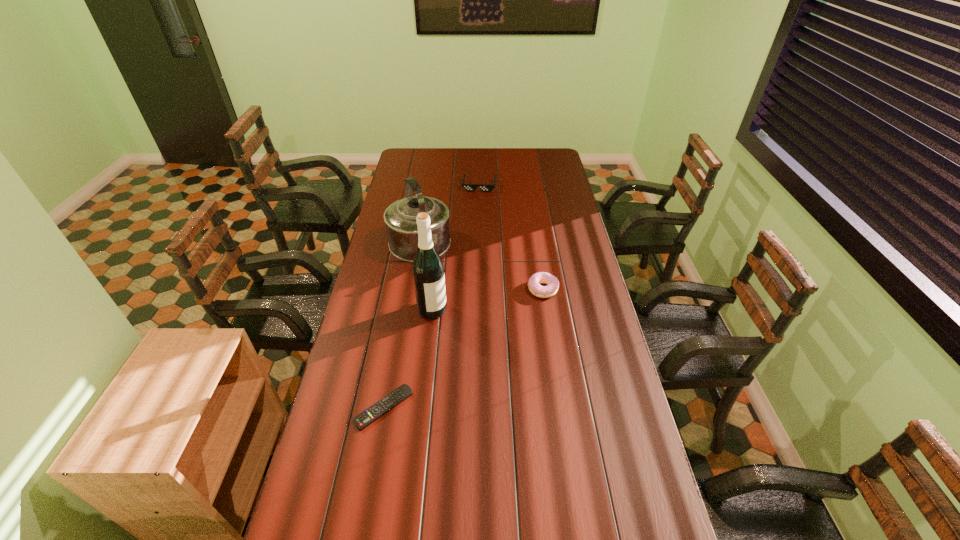
Identify the location of remote control. (387, 403).

Where is `the shortest object`? The width and height of the screenshot is (960, 540). the shortest object is located at coordinates (387, 403).

At what (x,y) coordinates should I click in order to perform the action: click on the rightmost object. Please return your answer as a coordinate pair (x, y). Image resolution: width=960 pixels, height=540 pixels. Looking at the image, I should click on (535, 280).

Locate an element on the screen. the second object from right to left is located at coordinates (469, 187).

Where is `the farthest object`? the farthest object is located at coordinates (469, 187).

Where is `the second farthest object`? Image resolution: width=960 pixels, height=540 pixels. the second farthest object is located at coordinates (400, 217).

Where is `kettle`? Image resolution: width=960 pixels, height=540 pixels. kettle is located at coordinates (400, 217).

Where is `wine bottle`? This screenshot has width=960, height=540. wine bottle is located at coordinates (428, 271).

Locate an element on the screen. Image resolution: width=960 pixels, height=540 pixels. vacant space located on the right of the shortest object is located at coordinates (468, 407).

You are a GUI agent. You are given a task and a screenshot of the screen. Output one action in this format:
    pyautogui.click(x=<x>, y=<y>)
    Task: Click on the vacant space located on the front of the rightmost object
    The image size is (960, 540).
    Given the screenshot: What is the action you would take?
    pyautogui.click(x=556, y=375)